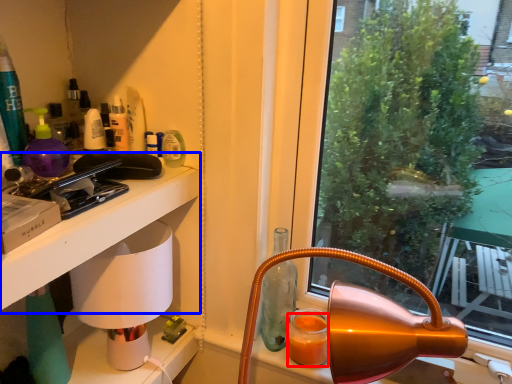
Question: Among these objects, which one is farthest to the camera, orange juice (highlighted by a red box) or table (highlighted by a blue box)?

Choices:
 (A) orange juice
 (B) table

Answer: (A)